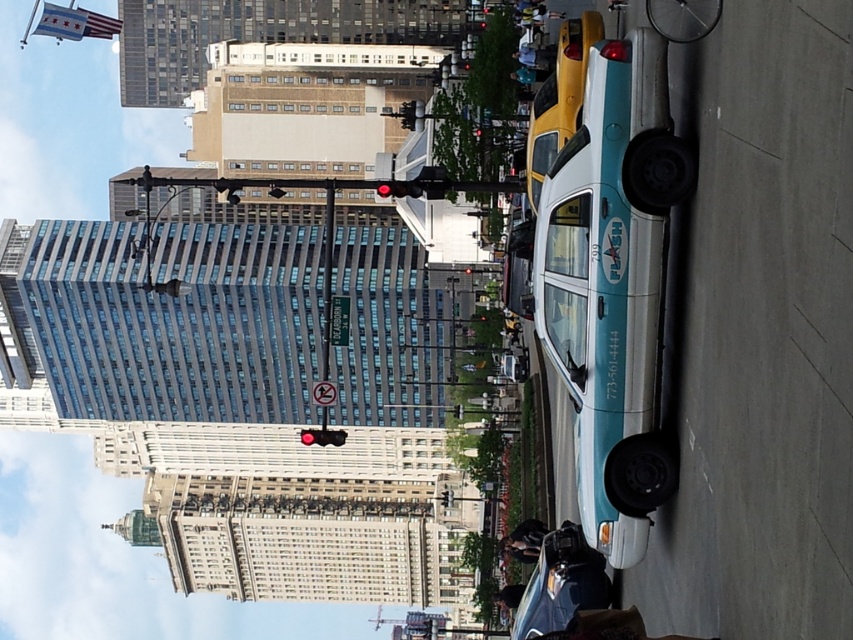
Does teal glossy taxi at center have a lesser height compared to teal glossy taxi at lower right?

Incorrect, teal glossy taxi at center's height does not fall short of teal glossy taxi at lower right's.

Is point (637, 228) positioned before point (544, 604)?

That is True.

Locate an element on the screen. This screenshot has height=640, width=853. teal glossy taxi at center is located at coordinates (602, 276).